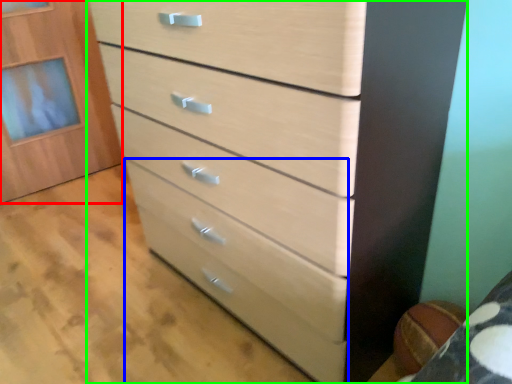
Question: Considering the real-world distances, which object is closest to cabinetry (highlighted by a red box)? drawer (highlighted by a blue box) or chest of drawers (highlighted by a green box).

Choices:
 (A) drawer
 (B) chest of drawers

Answer: (A)